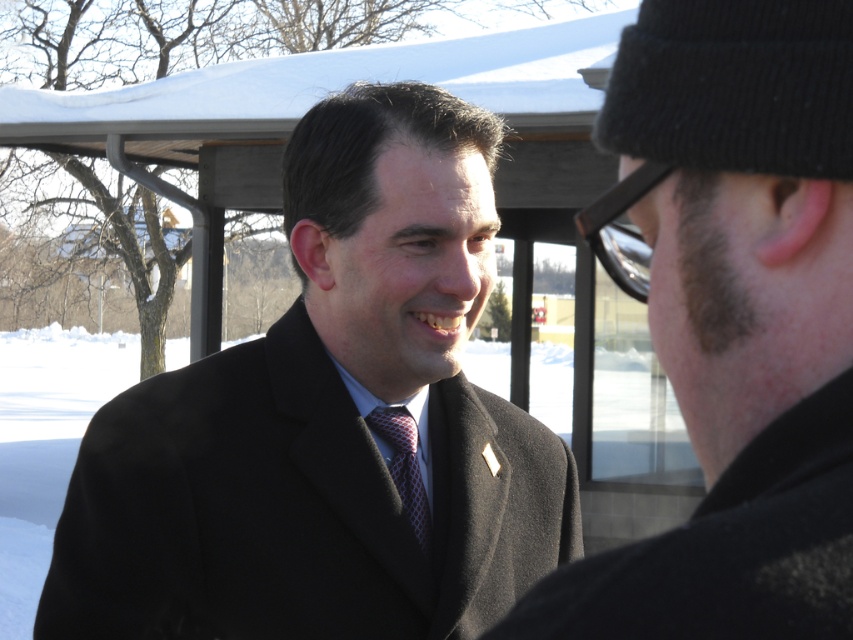
Who is lower down, matte black coat at center or metallic reflective goggles at right?

Positioned lower is matte black coat at center.

The image size is (853, 640). Describe the element at coordinates (732, 320) in the screenshot. I see `matte black coat at center` at that location.

Which is behind, point (782, 563) or point (610, 259)?

Point (610, 259)

At what (x,y) coordinates should I click in order to perform the action: click on matte black coat at center. Please return your answer as a coordinate pair (x, y). Looking at the image, I should click on (732, 320).

Does matte black coat at center have a greater height compared to red checkered tie at center?

Indeed, matte black coat at center has a greater height compared to red checkered tie at center.

Who is more distant from viewer, (616,106) or (415,460)?

Positioned behind is point (415,460).

From the picture: Measure the distance between matte black coat at center and camera.

matte black coat at center is 24.42 inches away from camera.

I want to click on matte black coat at center, so click(732, 320).

Can you confirm if metallic reflective goggles at right is positioned below red checkered tie at center?

No.

Does point (585, 209) come behind point (393, 429)?

That is True.

Between point (602, 214) and point (422, 499), which one is positioned behind?

The point (422, 499) is behind.

Locate an element on the screen. Image resolution: width=853 pixels, height=640 pixels. metallic reflective goggles at right is located at coordinates (622, 228).